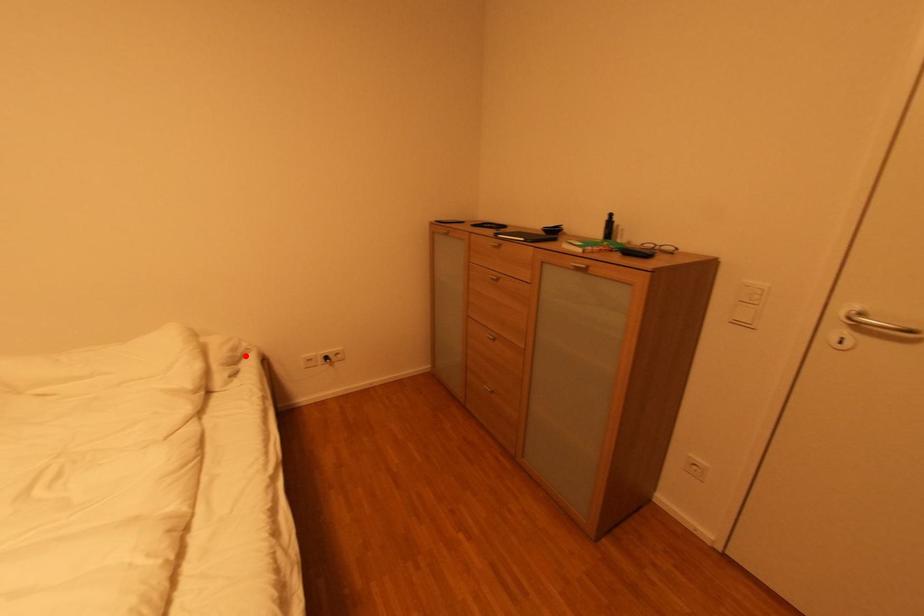
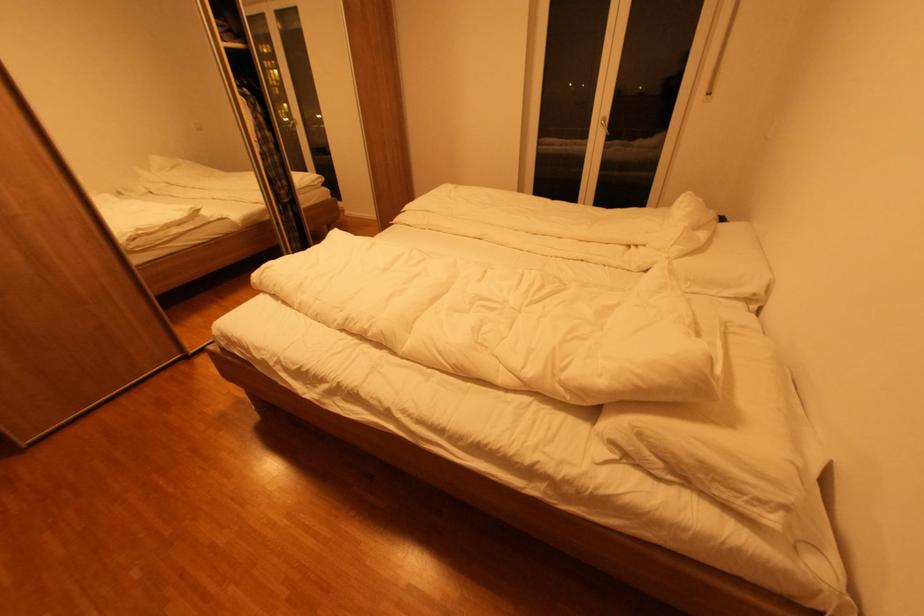
Question: I am providing you with two images of the same scene from different viewpoints. In image1, a red point is highlighted. Considering the same 3D point in image2, which of the following is correct?

Choices:
 (A) It is closer
 (B) It is farther

Answer: (B)